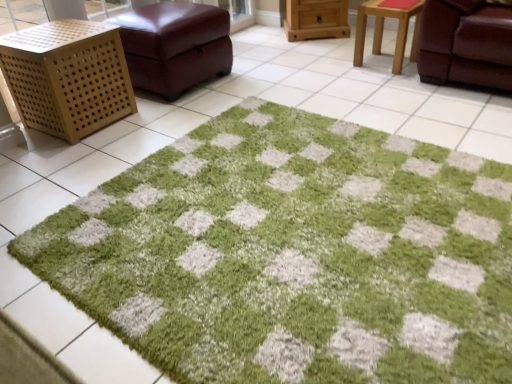
Question: From the image's perspective, would you say wooden stool at upper right is shown under wooden cabinet at upper center, the 3th furniture viewed from the left?

Choices:
 (A) no
 (B) yes

Answer: (B)

Question: Is wooden stool at upper right oriented away from wooden cabinet at upper center, the 3th furniture viewed from the left?

Choices:
 (A) no
 (B) yes

Answer: (A)

Question: Is wooden stool at upper right facing towards wooden cabinet at upper center, the 3th furniture viewed from the left?

Choices:
 (A) no
 (B) yes

Answer: (A)

Question: Does wooden stool at upper right have a lesser width compared to wooden cabinet at upper center, the 3th furniture viewed from the left?

Choices:
 (A) no
 (B) yes

Answer: (B)

Question: Considering the relative sizes of wooden stool at upper right and wooden cabinet at upper center, the 3th furniture viewed from the left, in the image provided, is wooden stool at upper right smaller than wooden cabinet at upper center, the 3th furniture viewed from the left,?

Choices:
 (A) yes
 (B) no

Answer: (A)

Question: Considering the relative positions of wooden stool at upper right and wooden cabinet at upper center, which ranks as the 1th furniture in right-to-left order, in the image provided, is wooden stool at upper right to the right of wooden cabinet at upper center, which ranks as the 1th furniture in right-to-left order, from the viewer's perspective?

Choices:
 (A) yes
 (B) no

Answer: (A)

Question: Does leather ottoman at upper left, the 2th furniture in the right-to-left sequence, lie in front of wooden stool at upper right?

Choices:
 (A) yes
 (B) no

Answer: (A)

Question: Is leather ottoman at upper left, the 2th furniture in the right-to-left sequence, next to wooden stool at upper right and touching it?

Choices:
 (A) no
 (B) yes

Answer: (A)

Question: Can you confirm if leather ottoman at upper left, the 2th furniture in the right-to-left sequence, is bigger than wooden stool at upper right?

Choices:
 (A) no
 (B) yes

Answer: (B)

Question: Is leather ottoman at upper left, placed as the 2th furniture when sorted from left to right, far away from wooden stool at upper right?

Choices:
 (A) no
 (B) yes

Answer: (B)

Question: Is leather ottoman at upper left, the 2th furniture in the right-to-left sequence, looking in the opposite direction of wooden stool at upper right?

Choices:
 (A) yes
 (B) no

Answer: (B)

Question: From a real-world perspective, does leather ottoman at upper left, the 2th furniture in the right-to-left sequence, stand above wooden stool at upper right?

Choices:
 (A) yes
 (B) no

Answer: (A)

Question: Is wooden cabinet at upper center, the 3th furniture viewed from the left, positioned in front of green shaggy rug at center?

Choices:
 (A) yes
 (B) no

Answer: (B)